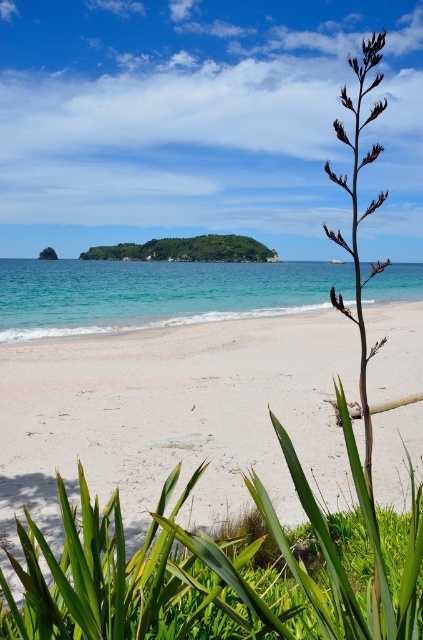
Question: Which of the following is the closest to the observer?

Choices:
 (A) white sandy beach at center
 (B) turquoise water at center
 (C) green leafy island at center

Answer: (A)

Question: Which of these objects is positioned farthest from the green leafy island at center?

Choices:
 (A) turquoise water at center
 (B) white sandy beach at center

Answer: (B)

Question: Which is farther from the white sandy beach at center?

Choices:
 (A) green leafy island at center
 (B) turquoise water at center

Answer: (A)

Question: In this image, where is turquoise water at center located relative to green leafy island at center?

Choices:
 (A) left
 (B) right

Answer: (B)

Question: Considering the relative positions of white sandy beach at center and green leafy island at center in the image provided, where is white sandy beach at center located with respect to green leafy island at center?

Choices:
 (A) left
 (B) right

Answer: (B)

Question: Does white sandy beach at center appear on the left side of green leafy island at center?

Choices:
 (A) no
 (B) yes

Answer: (A)